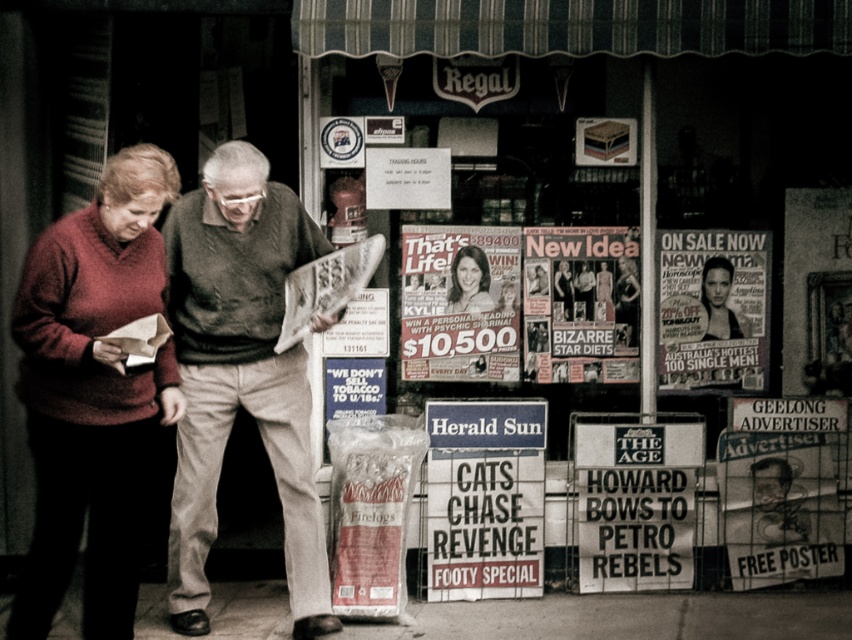
You are standing at the entrance of the Regal shop and want to greet the person wearing the dark green sweater at center. In which direction should you walk to reach them?

The dark green sweater at center is located at point 0.586 on the x axis and 0.283 on the y axis. Since you are at the entrance, you should walk towards the center of the image to reach them.

In the scene shown: You are a photographer trying to capture both the dark green sweater at center and the matte paper magazine at center in a single shot. Based on their positions, which object should you focus on first if you want to ensure both are in frame?

Since the dark green sweater at center is to the left of the matte paper magazine at center, you should focus on the dark green sweater at center first to ensure both are in frame.

You are a photographer standing in front of the Regal shop. You notice two items at the center of the scene, the dark green sweater at center and the black glossy poster at center. Which item appears taller?

The dark green sweater at center is taller than the black glossy poster at center according to the description provided.